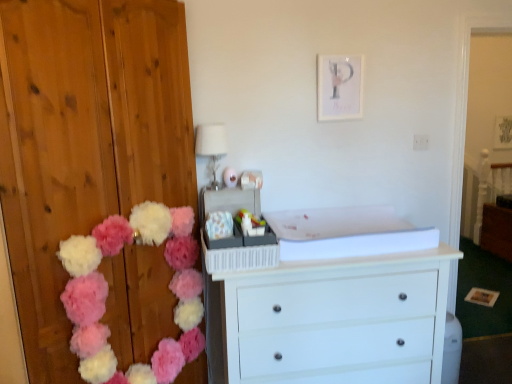
Image resolution: width=512 pixels, height=384 pixels. I want to click on vacant space underneath white glass lampshade at upper center (from a real-world perspective), so click(210, 186).